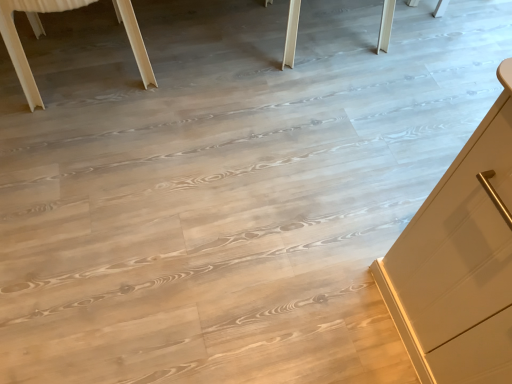
This screenshot has height=384, width=512. What do you see at coordinates (35, 34) in the screenshot? I see `light wood table at upper left` at bounding box center [35, 34].

At what (x,y) coordinates should I click in order to perform the action: click on light wood table at upper left. Please return your answer as a coordinate pair (x, y). The image size is (512, 384). Looking at the image, I should click on (35, 34).

The image size is (512, 384). Find the location of `natural wood table at upper center`. natural wood table at upper center is located at coordinates (35, 34).

Image resolution: width=512 pixels, height=384 pixels. What do you see at coordinates (35, 34) in the screenshot?
I see `natural wood table at upper center` at bounding box center [35, 34].

Image resolution: width=512 pixels, height=384 pixels. Find the location of `light wood table at upper left`. light wood table at upper left is located at coordinates (35, 34).

Considering the relative positions of natural wood table at upper center and light wood table at upper left in the image provided, is natural wood table at upper center to the left or to the right of light wood table at upper left?

From the image, it's evident that natural wood table at upper center is to the right of light wood table at upper left.

Between natural wood table at upper center and light wood table at upper left, which one is positioned behind?

natural wood table at upper center is further from the camera.

Considering the positions of point (146, 59) and point (128, 3), is point (146, 59) closer or farther from the camera than point (128, 3)?

Point (146, 59) is farther from the camera than point (128, 3).

From the image's perspective, is natural wood table at upper center over light wood table at upper left?

Correct, natural wood table at upper center appears higher than light wood table at upper left in the image.

From a real-world perspective, is natural wood table at upper center under light wood table at upper left?

Yes.

Which of these two, natural wood table at upper center or light wood table at upper left, is wider?

natural wood table at upper center is wider.

Considering the sizes of natural wood table at upper center and light wood table at upper left in the image, is natural wood table at upper center taller or shorter than light wood table at upper left?

natural wood table at upper center is shorter than light wood table at upper left.

Between natural wood table at upper center and light wood table at upper left, which one has larger size?

With larger size is natural wood table at upper center.

Choose the correct answer: Is natural wood table at upper center inside light wood table at upper left or outside it?

natural wood table at upper center exists outside the volume of light wood table at upper left.

Is natural wood table at upper center not close to light wood table at upper left?

natural wood table at upper center is near light wood table at upper left, not far away.

Is natural wood table at upper center oriented away from light wood table at upper left?

Yes, natural wood table at upper center is facing away from light wood table at upper left.

How many degrees apart are the facing directions of natural wood table at upper center and light wood table at upper left?

The facing directions of natural wood table at upper center and light wood table at upper left are 177 degrees apart.

In order to click on furniture that appears below the natural wood table at upper center (from the image's perspective) in this screenshot , I will do `click(35, 34)`.

Is light wood table at upper left at the right side of natural wood table at upper center?

Incorrect, light wood table at upper left is not on the right side of natural wood table at upper center.

Considering their positions, is light wood table at upper left located in front of or behind natural wood table at upper center?

Visually, light wood table at upper left is located in front of natural wood table at upper center.

Which is behind, point (137, 24) or point (29, 15)?

The point (29, 15) is farther from the camera.

From the image's perspective, is light wood table at upper left located beneath natural wood table at upper center?

Correct, light wood table at upper left appears lower than natural wood table at upper center in the image.

From a real-world perspective, is light wood table at upper left positioned over natural wood table at upper center based on gravity?

Yes, from a real-world perspective, light wood table at upper left is over natural wood table at upper center

Looking at their sizes, would you say light wood table at upper left is wider or thinner than natural wood table at upper center?

Considering their sizes, light wood table at upper left looks slimmer than natural wood table at upper center.

Considering the sizes of objects light wood table at upper left and natural wood table at upper center in the image provided, who is taller, light wood table at upper left or natural wood table at upper center?

light wood table at upper left is taller.

From the picture: Considering the relative sizes of light wood table at upper left and natural wood table at upper center in the image provided, is light wood table at upper left smaller than natural wood table at upper center?

Indeed, light wood table at upper left has a smaller size compared to natural wood table at upper center.

Can natural wood table at upper center be found inside light wood table at upper left?

Definitely not — natural wood table at upper center is not inside light wood table at upper left.

Is there a large distance between light wood table at upper left and natural wood table at upper center?

Actually, light wood table at upper left and natural wood table at upper center are a little close together.

Is light wood table at upper left facing away from natural wood table at upper center?

Yes, natural wood table at upper center is at the back of light wood table at upper left.

Find the location of `table lying on the right of light wood table at upper left`. table lying on the right of light wood table at upper left is located at coordinates (35, 34).

Where is `table above the light wood table at upper left (from the image's perspective)`? Image resolution: width=512 pixels, height=384 pixels. table above the light wood table at upper left (from the image's perspective) is located at coordinates (35, 34).

This screenshot has width=512, height=384. Find the location of `table behind the light wood table at upper left`. table behind the light wood table at upper left is located at coordinates (35, 34).